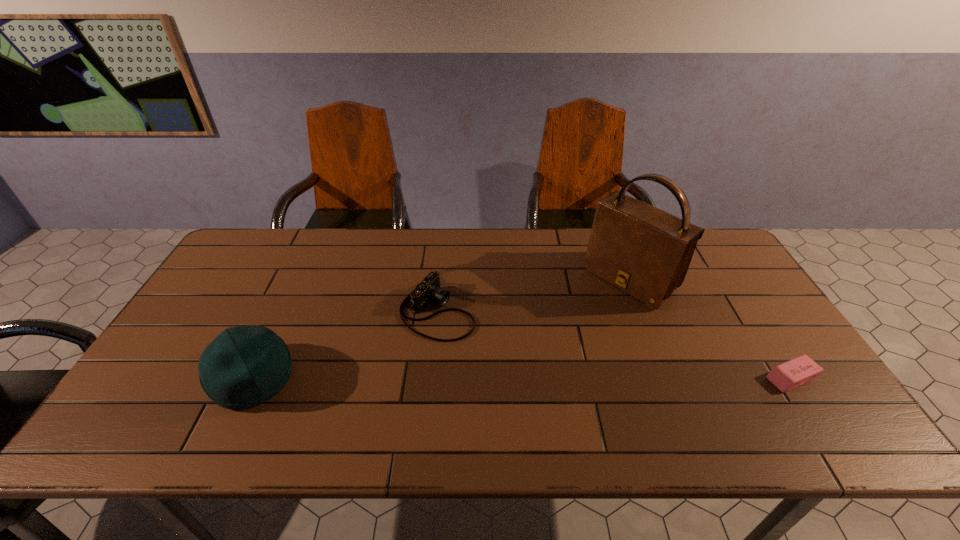
Image resolution: width=960 pixels, height=540 pixels. Find the location of `vacant space that's between the third tallest object and the rightmost object`. vacant space that's between the third tallest object and the rightmost object is located at coordinates (614, 345).

This screenshot has width=960, height=540. I want to click on vacant area that lies between the second tallest object and the second shortest object, so click(345, 345).

You are a GUI agent. You are given a task and a screenshot of the screen. Output one action in this format:
    pyautogui.click(x=<x>, y=<y>)
    Task: Click on the free point between the second shortest object and the rightmost object
    
    Given the screenshot: What is the action you would take?
    pyautogui.click(x=614, y=345)

Find the location of `vacant region between the third object from left to right and the shortest object`. vacant region between the third object from left to right and the shortest object is located at coordinates (710, 329).

Locate an element on the screen. The width and height of the screenshot is (960, 540). empty space that is in between the rightmost object and the second shortest object is located at coordinates (614, 345).

Locate an element on the screen. free area in between the second shortest object and the shoulder bag is located at coordinates (534, 295).

What are the coordinates of `vacant area that lies between the third object from left to right and the eraser` in the screenshot? It's located at click(710, 329).

Identify the location of free spot between the camera and the eraser. (614, 345).

Where is `object that is the third closest one to the tallest object`? The height and width of the screenshot is (540, 960). object that is the third closest one to the tallest object is located at coordinates (245, 366).

This screenshot has width=960, height=540. What are the coordinates of `object that stands as the closest to the leftmost object` in the screenshot? It's located at (428, 290).